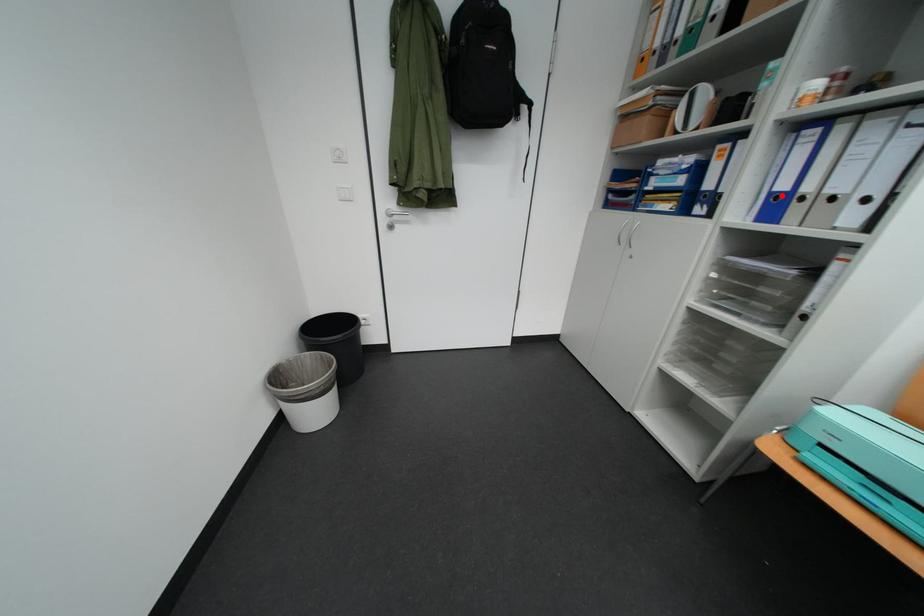
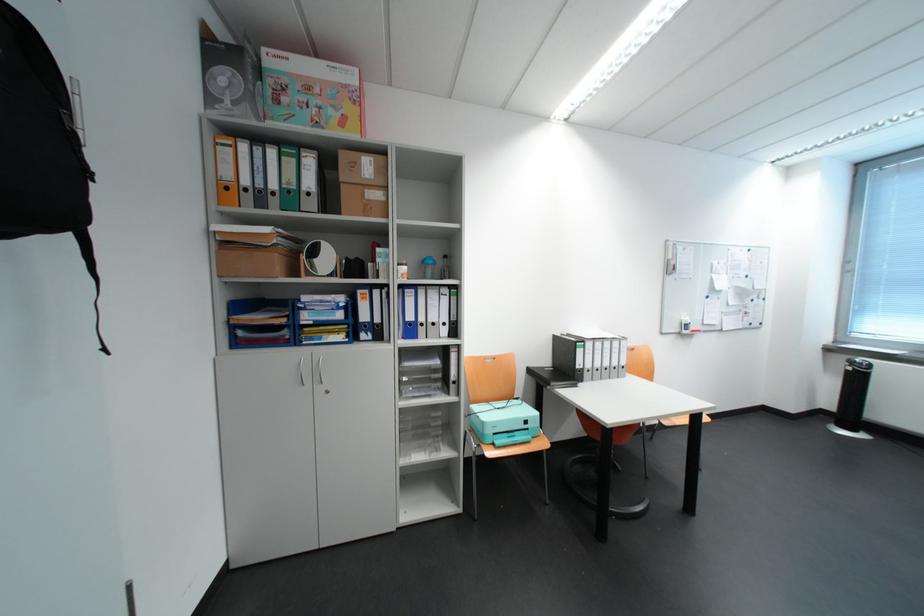
In the second image, find the point that corresponds to the highlighted location in the first image.

(417, 323)